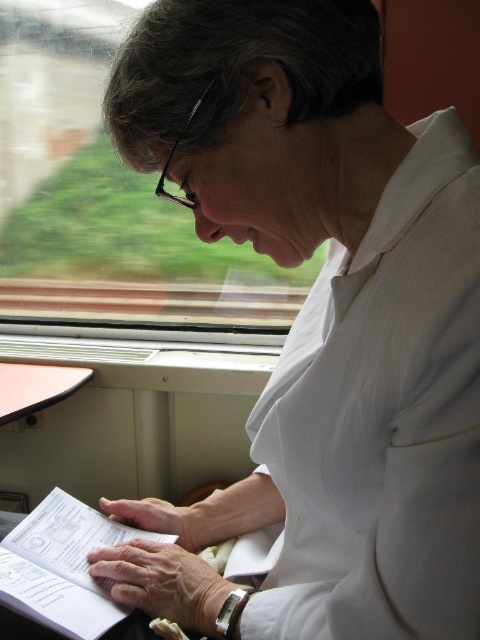
Question: Is transparent glass train window at upper left positioned behind white paper book at lower left?

Choices:
 (A) yes
 (B) no

Answer: (A)

Question: Which point is closer to the camera?

Choices:
 (A) (168, 260)
 (B) (72, 602)

Answer: (B)

Question: Is the position of transparent glass train window at upper left more distant than that of white paper book at lower left?

Choices:
 (A) no
 (B) yes

Answer: (B)

Question: Which of the following is the farthest from the observer?

Choices:
 (A) (60, 593)
 (B) (243, 310)

Answer: (B)

Question: Is transparent glass train window at upper left to the left of white paper book at lower left from the viewer's perspective?

Choices:
 (A) no
 (B) yes

Answer: (B)

Question: Which point is farther from the camera taking this photo?

Choices:
 (A) (19, 605)
 (B) (43, 204)

Answer: (B)